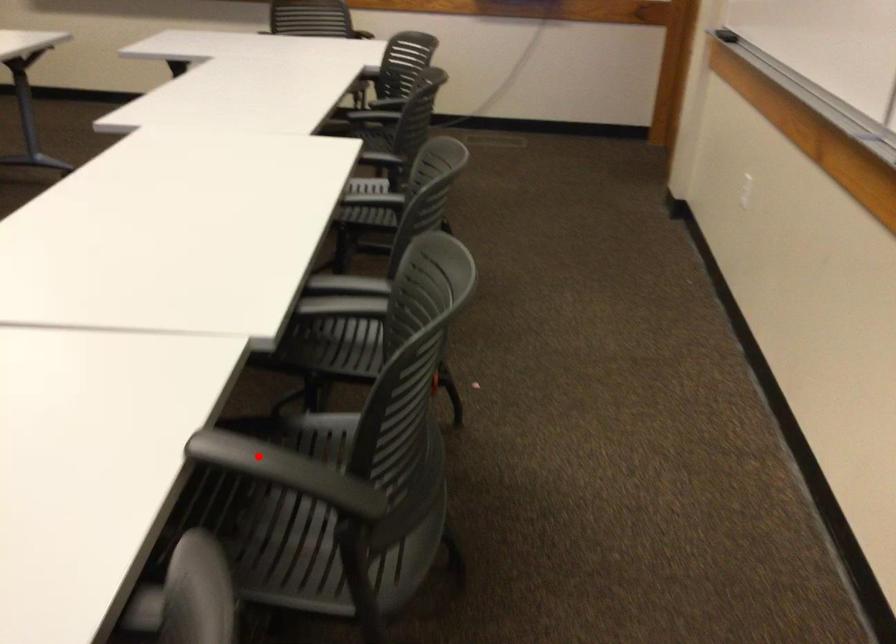
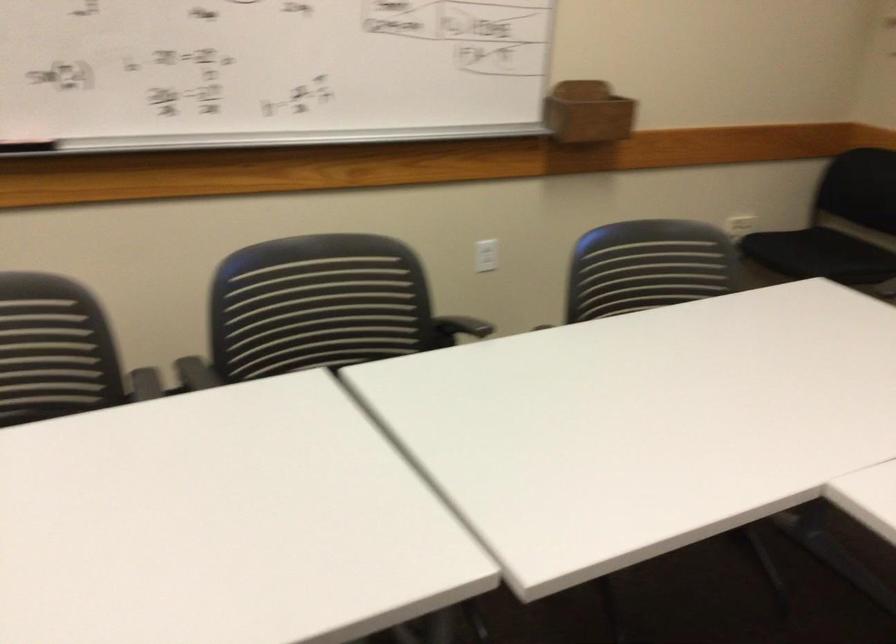
Question: A red point is marked in image1. In image2, is the corresponding 3D point closer to the camera or farther? Reply with the corresponding letter.

Choices:
 (A) The corresponding 3D point is closer.
 (B) The corresponding 3D point is farther.

Answer: (B)